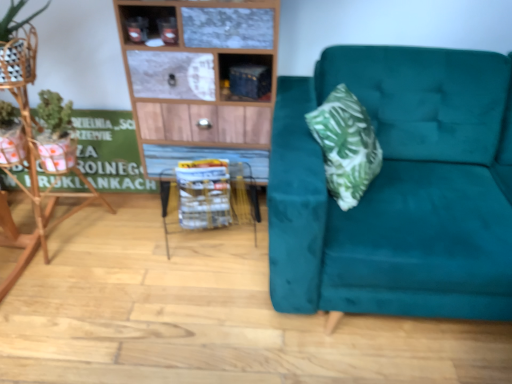
Question: In terms of size, does metallic wireframe table at center appear bigger or smaller than teal velvet couch at right?

Choices:
 (A) small
 (B) big

Answer: (A)

Question: From a real-world perspective, is metallic wireframe table at center positioned above or below teal velvet couch at right?

Choices:
 (A) below
 (B) above

Answer: (A)

Question: Which object is positioned closest to the teal velvet couch at right?

Choices:
 (A) white plastic basket at center
 (B) metallic blue cabinet at upper center
 (C) metallic wireframe table at center

Answer: (B)

Question: Which object is the closest to the white plastic basket at center?

Choices:
 (A) metallic blue cabinet at upper center
 (B) metallic wireframe table at center
 (C) teal velvet couch at right

Answer: (B)